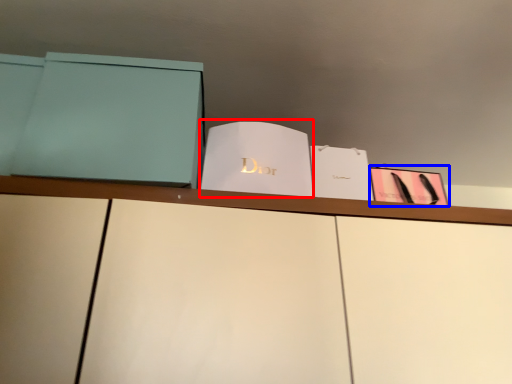
Question: Which object appears closest to the camera in this image, paperback book (highlighted by a red box) or paperback book (highlighted by a blue box)?

Choices:
 (A) paperback book
 (B) paperback book

Answer: (A)